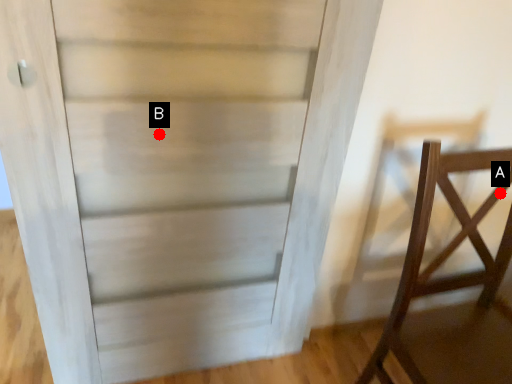
Question: Two points are circled on the image, labeled by A and B beside each circle. Which of the following is the farthest from the observer?

Choices:
 (A) A is further
 (B) B is further

Answer: (A)